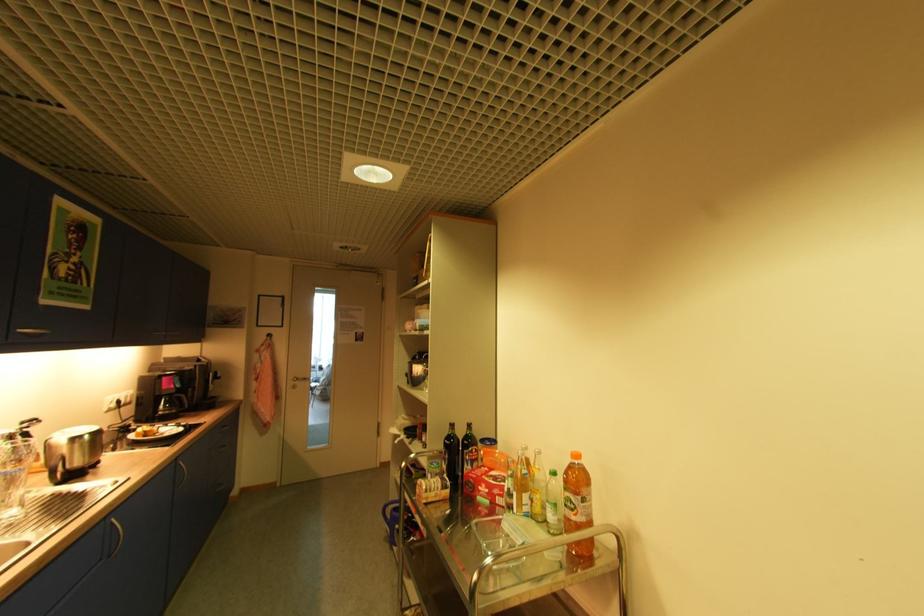
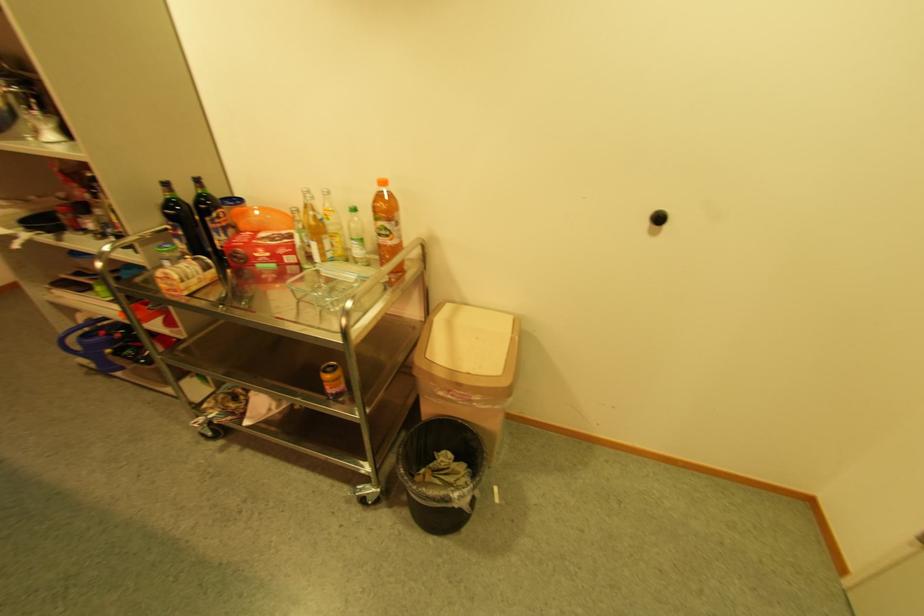
Question: I am providing you with two images of the same scene from different viewpoints. Please identify which objects are invisible in image2.

Choices:
 (A) blue bucket handle
 (B) green glass bottle
 (C) orange plastic bowl
 (D) none of these

Answer: (D)